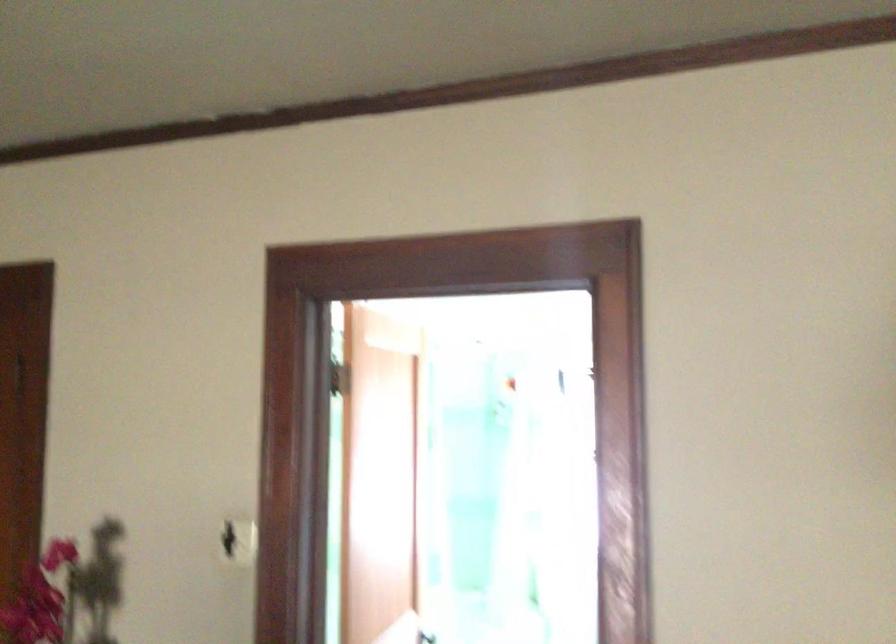
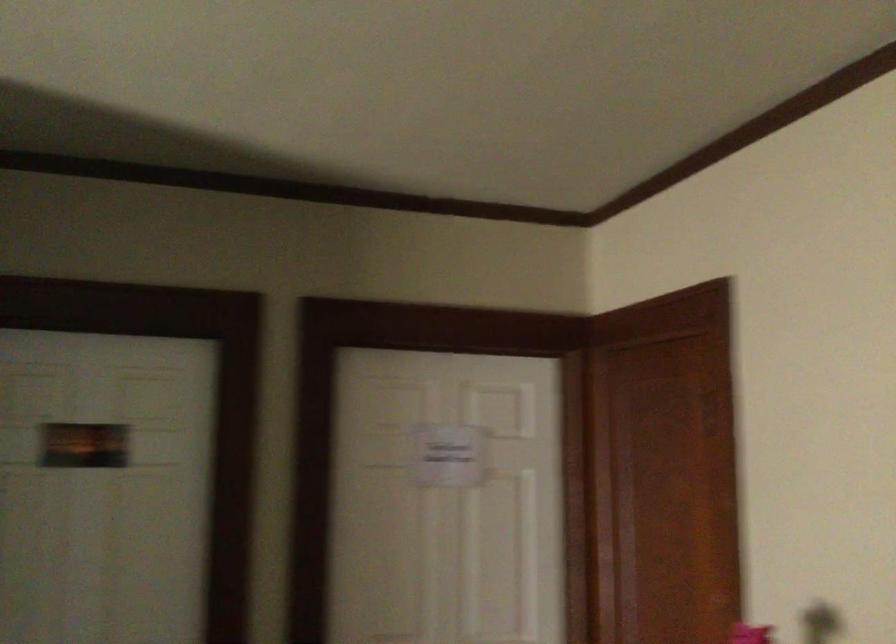
Question: Based on the continuous images, in which direction is the camera rotating? Reply with the corresponding letter.

Choices:
 (A) Left
 (B) Right
 (C) Up
 (D) Down

Answer: (A)